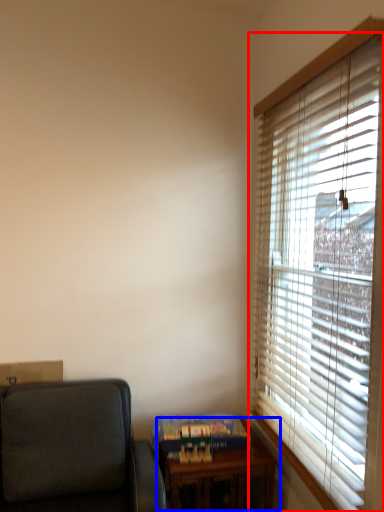
Question: Which object is further to the camera taking this photo, window blind (highlighted by a red box) or table (highlighted by a blue box)?

Choices:
 (A) window blind
 (B) table

Answer: (B)